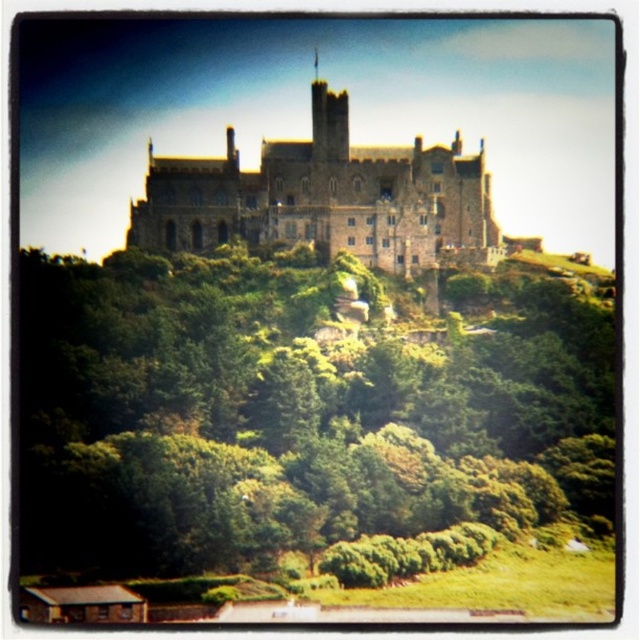
Question: Which point is farther from the camera taking this photo?

Choices:
 (A) (609, 438)
 (B) (428, 172)

Answer: (B)

Question: Does green leafy tree at upper center appear on the right side of brown stone castle at center?

Choices:
 (A) yes
 (B) no

Answer: (B)

Question: Can you confirm if green leafy tree at upper center is bigger than brown stone castle at center?

Choices:
 (A) no
 (B) yes

Answer: (B)

Question: Can you confirm if green leafy tree at upper center is thinner than brown stone castle at center?

Choices:
 (A) no
 (B) yes

Answer: (A)

Question: Which point is farther to the camera?

Choices:
 (A) brown stone castle at center
 (B) green leafy tree at upper center

Answer: (A)